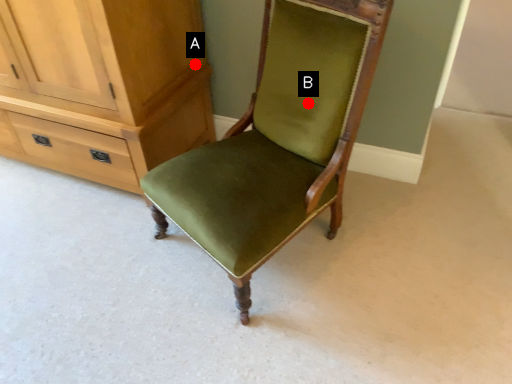
Question: Two points are circled on the image, labeled by A and B beside each circle. Among these points, which one is farthest from the camera?

Choices:
 (A) A is further
 (B) B is further

Answer: (A)